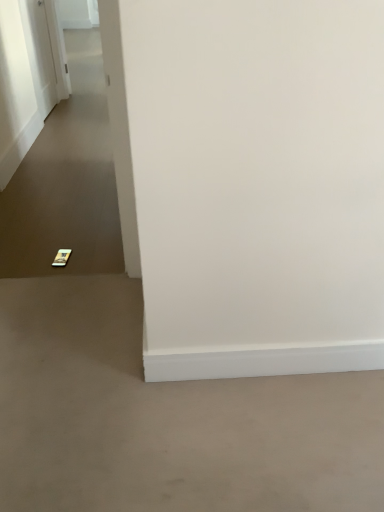
Question: Is white glossy door at upper left at the left side of gray matte concrete at lower left?

Choices:
 (A) no
 (B) yes

Answer: (B)

Question: Does white glossy door at upper left have a larger size compared to gray matte concrete at lower left?

Choices:
 (A) yes
 (B) no

Answer: (B)

Question: Is white glossy door at upper left far from gray matte concrete at lower left?

Choices:
 (A) no
 (B) yes

Answer: (B)

Question: Is white glossy door at upper left facing towards gray matte concrete at lower left?

Choices:
 (A) yes
 (B) no

Answer: (B)

Question: From the image's perspective, is white glossy door at upper left above gray matte concrete at lower left?

Choices:
 (A) yes
 (B) no

Answer: (A)

Question: Does white glossy door at upper left lie in front of gray matte concrete at lower left?

Choices:
 (A) no
 (B) yes

Answer: (A)

Question: Is the depth of gray matte concrete at lower left greater than that of white glossy door at upper left?

Choices:
 (A) no
 (B) yes

Answer: (A)

Question: Is white glossy door at upper left surrounded by gray matte concrete at lower left?

Choices:
 (A) yes
 (B) no

Answer: (B)

Question: From a real-world perspective, is gray matte concrete at lower left over white glossy door at upper left?

Choices:
 (A) no
 (B) yes

Answer: (A)

Question: Is gray matte concrete at lower left at the right side of white glossy door at upper left?

Choices:
 (A) no
 (B) yes

Answer: (B)

Question: Considering the relative sizes of gray matte concrete at lower left and white glossy door at upper left in the image provided, is gray matte concrete at lower left taller than white glossy door at upper left?

Choices:
 (A) yes
 (B) no

Answer: (B)

Question: Is gray matte concrete at lower left closer to the viewer compared to white glossy door at upper left?

Choices:
 (A) yes
 (B) no

Answer: (A)

Question: Considering the relative positions of gold metallic phone at lower left and gray matte concrete at lower left in the image provided, is gold metallic phone at lower left to the left of gray matte concrete at lower left from the viewer's perspective?

Choices:
 (A) no
 (B) yes

Answer: (B)